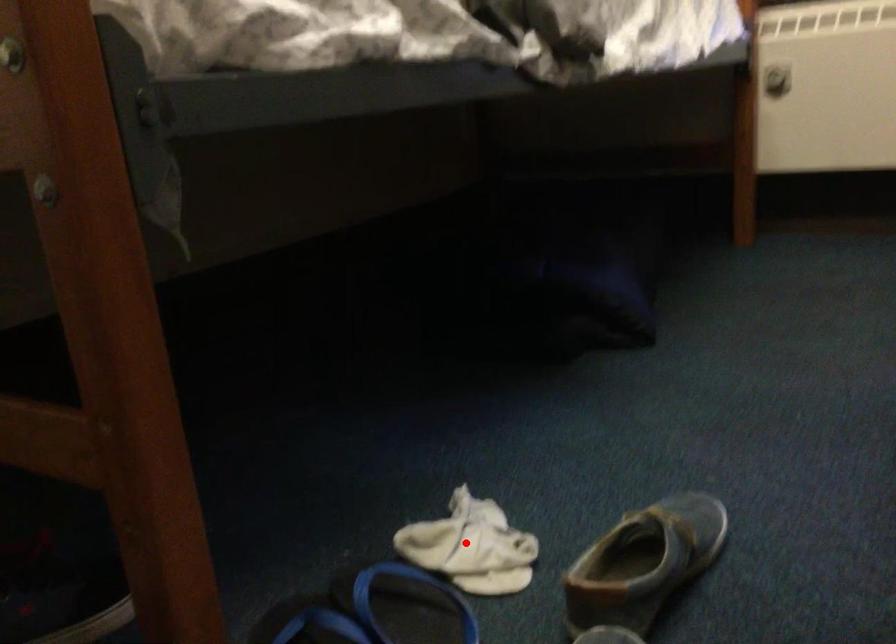
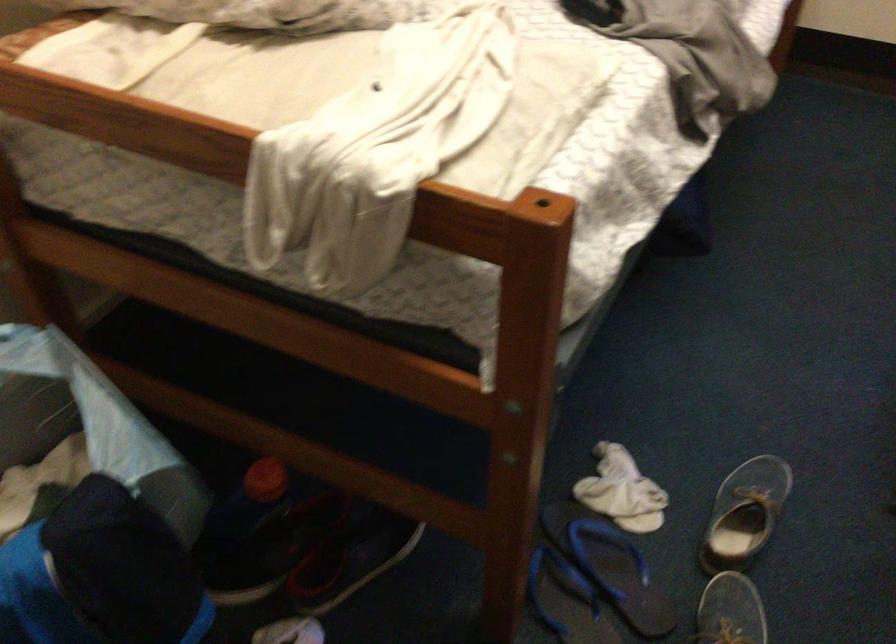
Find the pixel in the second image that matches the highlighted location in the first image.

(622, 491)